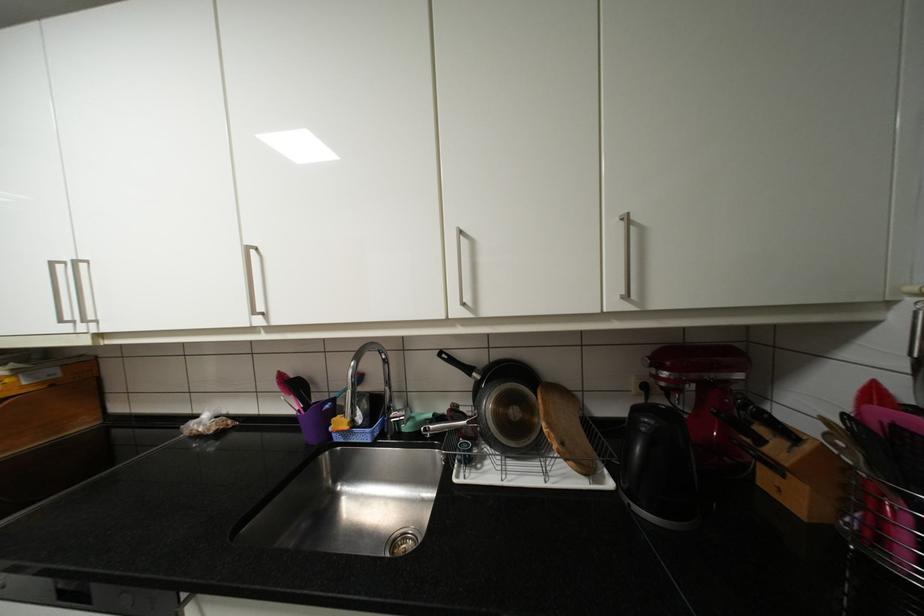
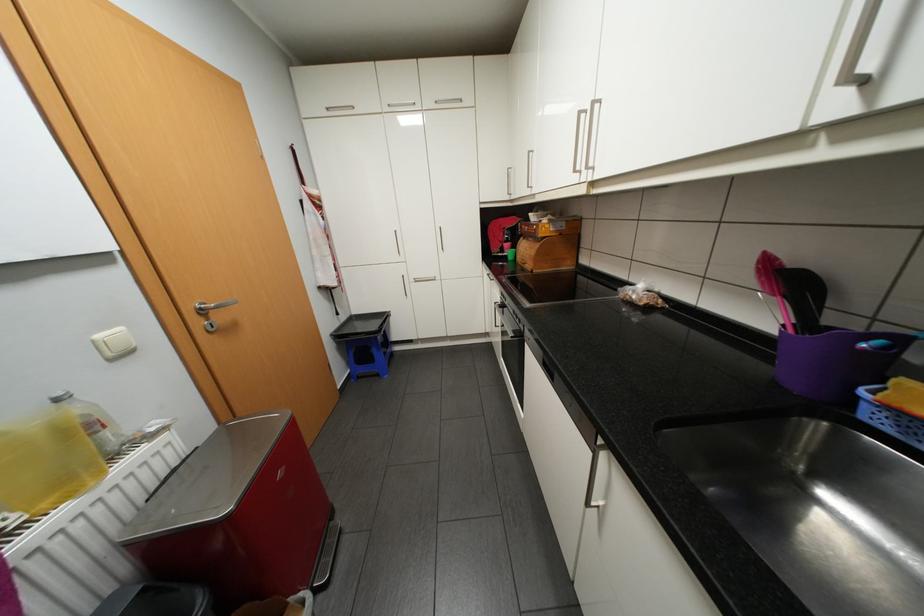
Locate, in the second image, the point that corresponds to pixel 284 387 in the first image.

(756, 276)